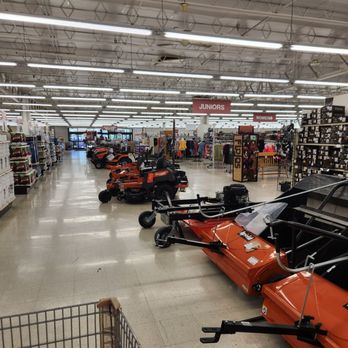
You are a GUI agent. You are given a task and a screenshot of the screen. Output one action in this format:
    pyautogui.click(x=<x>, y=<y>)
    Task: Click on the tile floor
    The height and width of the screenshot is (348, 348).
    Given the screenshot: What is the action you would take?
    pyautogui.click(x=80, y=255)